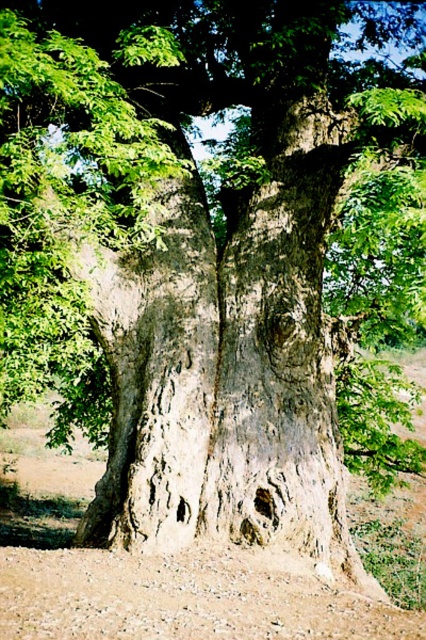
Question: Does brown sandy soil at center have a lesser width compared to brown sandy soil at lower center?

Choices:
 (A) no
 (B) yes

Answer: (A)

Question: Among these points, which one is nearest to the camera?

Choices:
 (A) (307, 588)
 (B) (227, 621)

Answer: (B)

Question: Is brown sandy soil at center to the right of brown sandy soil at lower center from the viewer's perspective?

Choices:
 (A) no
 (B) yes

Answer: (B)

Question: Is brown sandy soil at center below brown sandy soil at lower center?

Choices:
 (A) yes
 (B) no

Answer: (A)

Question: Which object is farther from the camera taking this photo?

Choices:
 (A) brown sandy soil at lower center
 (B) brown sandy soil at center

Answer: (B)

Question: Which point is farther to the camera?

Choices:
 (A) (135, 580)
 (B) (230, 580)

Answer: (B)